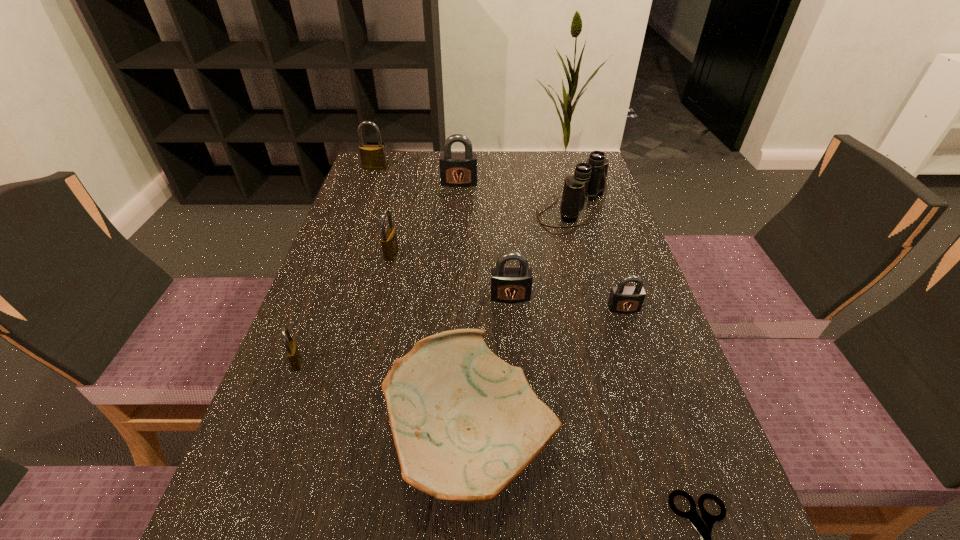
Where is `the farthest brass padlock`? The height and width of the screenshot is (540, 960). the farthest brass padlock is located at coordinates (372, 156).

Find the location of a particular element. the farthest object is located at coordinates (372, 156).

The height and width of the screenshot is (540, 960). In order to click on the farthest gray padlock in this screenshot , I will do `click(456, 169)`.

This screenshot has width=960, height=540. I want to click on the biggest gray padlock, so click(456, 169).

The height and width of the screenshot is (540, 960). What are the coordinates of `binoculars` in the screenshot? It's located at (589, 180).

Find the location of a particular element. the rightmost brass padlock is located at coordinates (389, 242).

Identify the location of the third object from left to right. point(389,242).

The height and width of the screenshot is (540, 960). I want to click on the second gray padlock from right to left, so click(510, 284).

This screenshot has height=540, width=960. I want to click on the second smallest gray padlock, so click(x=510, y=284).

I want to click on pottery, so click(465, 423).